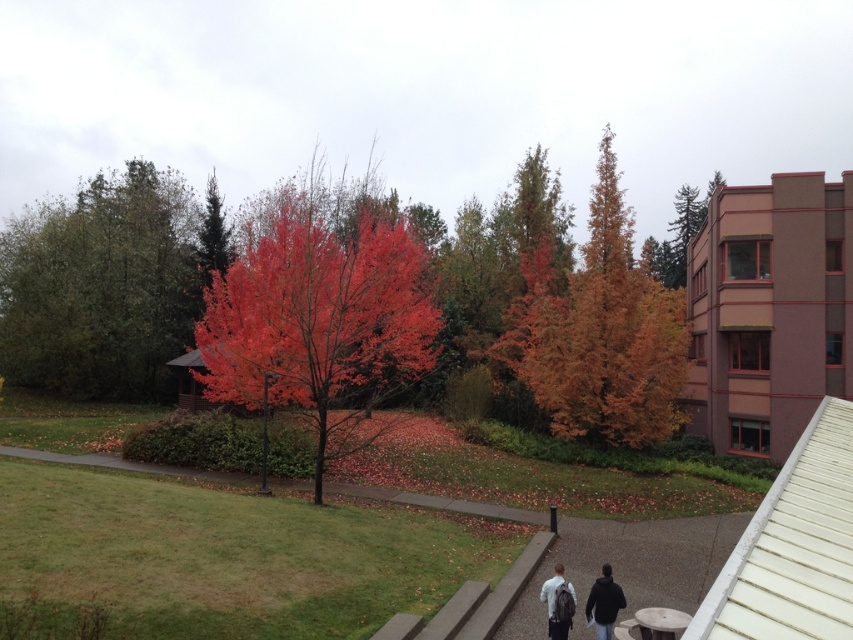
You are standing at the point marked by the coordinate (604, 602). What object is located exactly at this point?

The dark gray backpack at center is located exactly at the coordinate (604, 602).

You are planning to install a bench between the green matte tree at upper left and the orange matte tree at center. The bench is 2 meters long. Will there be enough space between them to place the bench without moving either tree?

The distance between the green matte tree at upper left and the orange matte tree at center is 29.07 meters, which is more than enough to accommodate a 2 meter long bench. Yes, there is sufficient space.

In the scene shown: You are standing at the start of the pathway and see two backpacks, the dark gray backpack at center and the light gray backpack at center. Which backpack is positioned to the right when looking towards the pathway?

The dark gray backpack at center is positioned to the right of the light gray backpack at center.